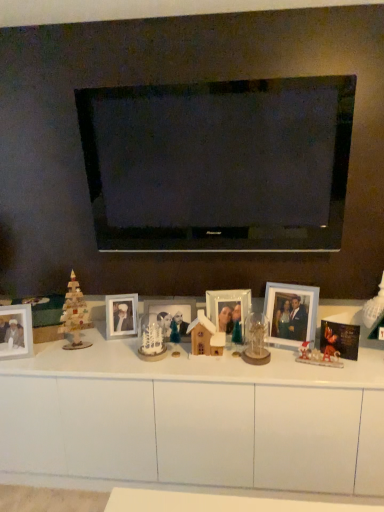
This screenshot has width=384, height=512. Find the location of `free space in front of metallic gold ornament at center-right, positioned as the 3th toy in left-to-right order`. free space in front of metallic gold ornament at center-right, positioned as the 3th toy in left-to-right order is located at coordinates pos(324,373).